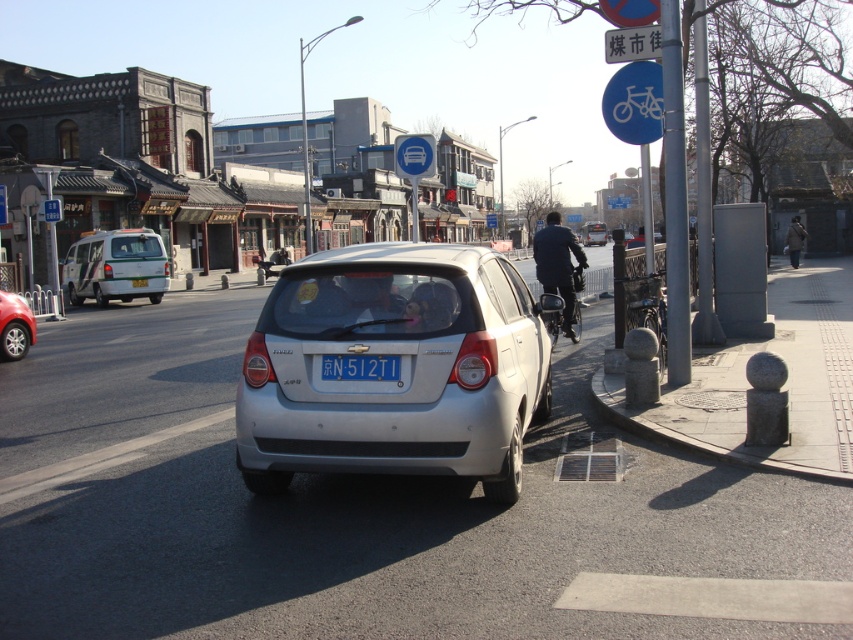
You are a pedestrian standing at the crosswalk. You see a dark blue jacket at center and a blue plastic sign at center. Which object is taller?

The dark blue jacket at center is shorter than the blue plastic sign at center.